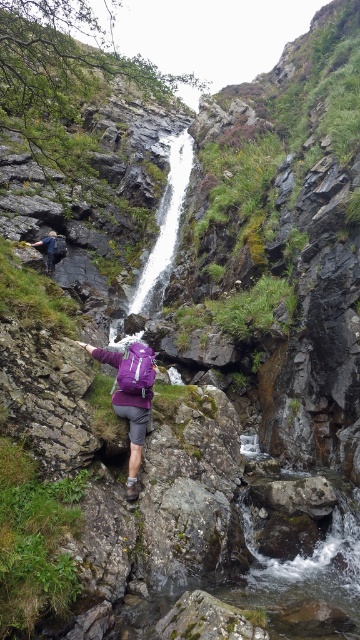
I want to click on white smooth waterfall at center, so click(164, 224).

I want to click on white smooth waterfall at center, so click(x=164, y=224).

The image size is (360, 640). Identify the location of white smooth waterfall at center. (164, 224).

Which is more to the right, purple fabric backpack at center or purple fabric backpack at lower left?

From the viewer's perspective, purple fabric backpack at center appears more on the right side.

Can you confirm if purple fabric backpack at center is smaller than purple fabric backpack at lower left?

Correct, purple fabric backpack at center occupies less space than purple fabric backpack at lower left.

Find the location of a particular element. The width and height of the screenshot is (360, 640). purple fabric backpack at center is located at coordinates (131, 397).

Is white smooth waterfall at center wider than purple fabric backpack at lower left?

Correct, the width of white smooth waterfall at center exceeds that of purple fabric backpack at lower left.

Between point (173, 234) and point (56, 259), which one is positioned in front?

Point (56, 259) is in front.

Image resolution: width=360 pixels, height=640 pixels. Describe the element at coordinates (164, 224) in the screenshot. I see `white smooth waterfall at center` at that location.

This screenshot has width=360, height=640. Identify the location of white smooth waterfall at center. (164, 224).